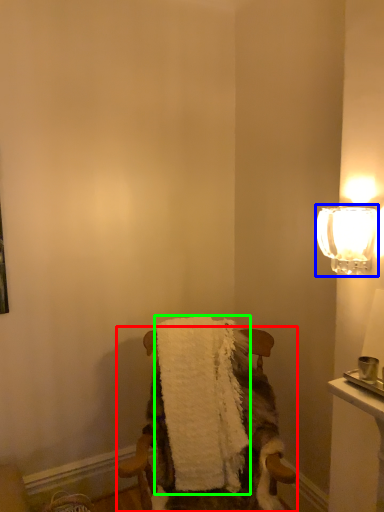
Question: Which object is the closest to the chair (highlighted by a red box)? Choose among these: lamp (highlighted by a blue box) or bath towel (highlighted by a green box).

Choices:
 (A) lamp
 (B) bath towel

Answer: (B)